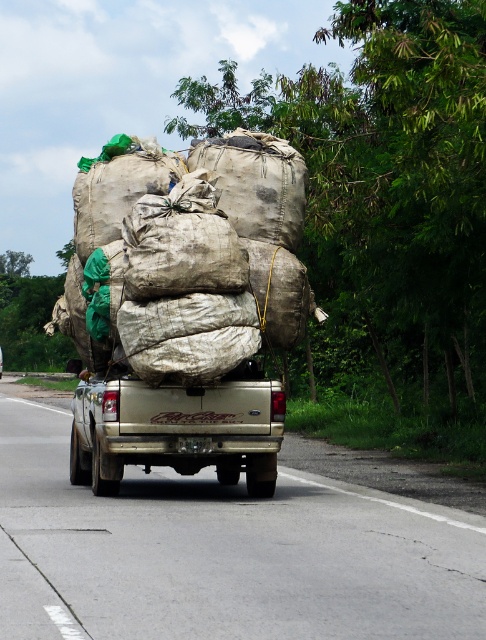
Question: Can you confirm if gold metallic truck at center is wider than gold matte truck at center?

Choices:
 (A) no
 (B) yes

Answer: (B)

Question: In this image, where is gold metallic truck at center located relative to gold matte truck at center?

Choices:
 (A) above
 (B) below

Answer: (B)

Question: Which of the following is the farthest from the observer?

Choices:
 (A) (105, 387)
 (B) (364, 499)

Answer: (B)

Question: Does gold metallic truck at center have a lesser width compared to gold matte truck at center?

Choices:
 (A) no
 (B) yes

Answer: (A)